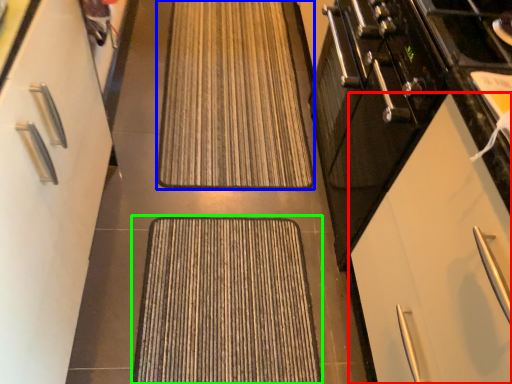
Question: Considering the real-world distances, which object is closest to cabinetry (highlighted by a red box)? doormat (highlighted by a blue box) or doormat (highlighted by a green box).

Choices:
 (A) doormat
 (B) doormat

Answer: (B)